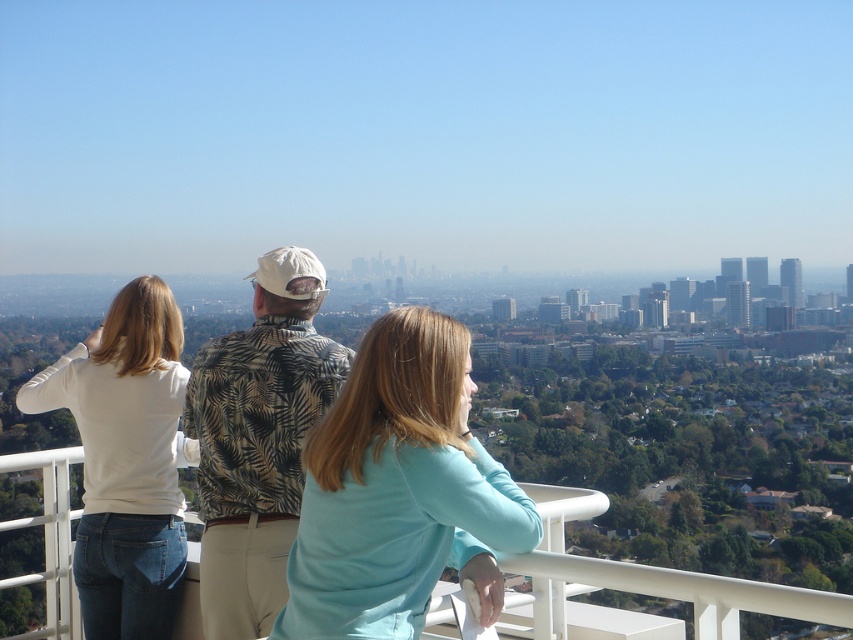
Question: Can you confirm if light blue fabric at center is thinner than white matte shirt at left?

Choices:
 (A) yes
 (B) no

Answer: (B)

Question: Which object appears farthest from the camera in this image?

Choices:
 (A) light blue fabric at center
 (B) white matte shirt at left

Answer: (B)

Question: Is white cotton shirt at center positioned at the back of white matte shirt at left?

Choices:
 (A) yes
 (B) no

Answer: (B)

Question: Which object is positioned farthest from the white cotton shirt at center?

Choices:
 (A) white matte shirt at left
 (B) light blue fabric at center
 (C) printed fabric shirt at center

Answer: (B)

Question: Estimate the real-world distances between objects in this image. Which object is farther from the white matte shirt at left?

Choices:
 (A) light blue fabric at center
 (B) printed fabric shirt at center
 (C) white cotton shirt at center

Answer: (A)

Question: Does light blue fabric at center have a greater width compared to white cotton shirt at center?

Choices:
 (A) yes
 (B) no

Answer: (B)